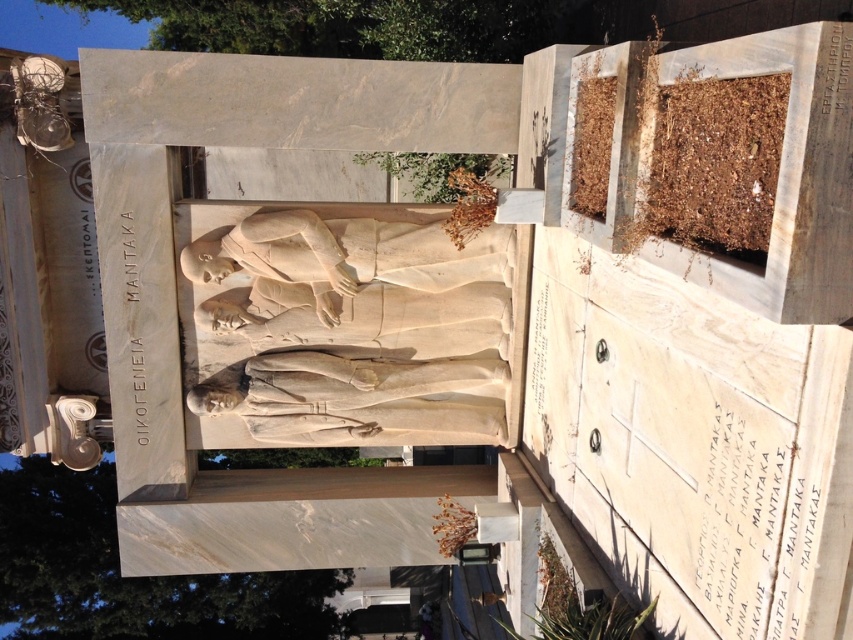
You are an archaeologist examining the marble monument. You notice the white marble statue at center and the black marble inscription at lower right. Based on their positions, which object is located to the left of the other?

The white marble statue at center is positioned on the left side of black marble inscription at lower right, so the white marble statue at center is to the left of the black marble inscription at lower right.

Based on the scene description, can you determine the spatial relationship between the white marble statue at center and the black marble inscription at lower right?

The white marble statue at center is located above the black marble inscription at lower right.